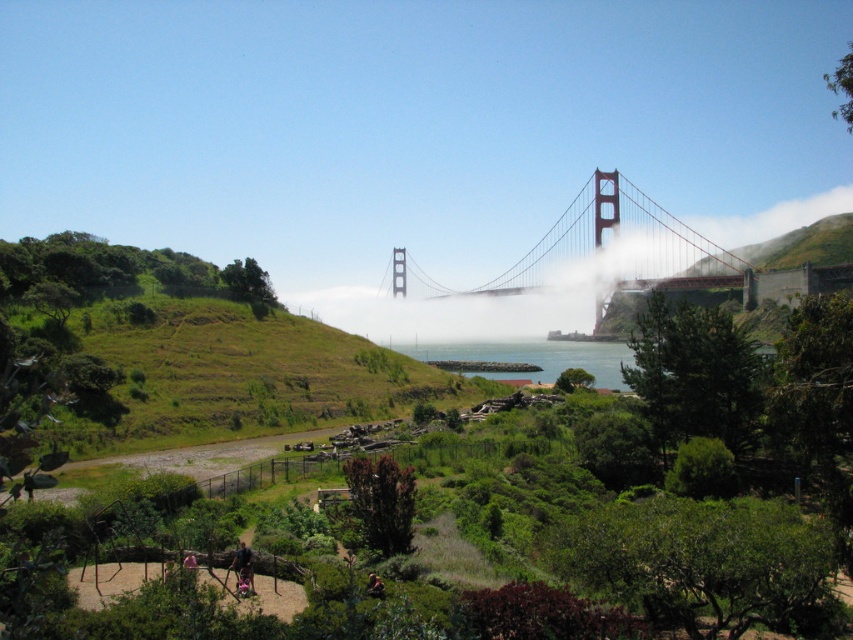
Question: Which object is farther from the camera taking this photo?

Choices:
 (A) red painted steel suspension bridge at center
 (B) clear blue water at center

Answer: (A)

Question: Does red painted steel suspension bridge at center appear over clear blue water at center?

Choices:
 (A) yes
 (B) no

Answer: (A)

Question: Which object appears closest to the camera in this image?

Choices:
 (A) clear blue water at center
 (B) red painted steel suspension bridge at center

Answer: (A)

Question: Where is red painted steel suspension bridge at center located in relation to clear blue water at center in the image?

Choices:
 (A) above
 (B) below

Answer: (A)

Question: Can you confirm if red painted steel suspension bridge at center is positioned below clear blue water at center?

Choices:
 (A) yes
 (B) no

Answer: (B)